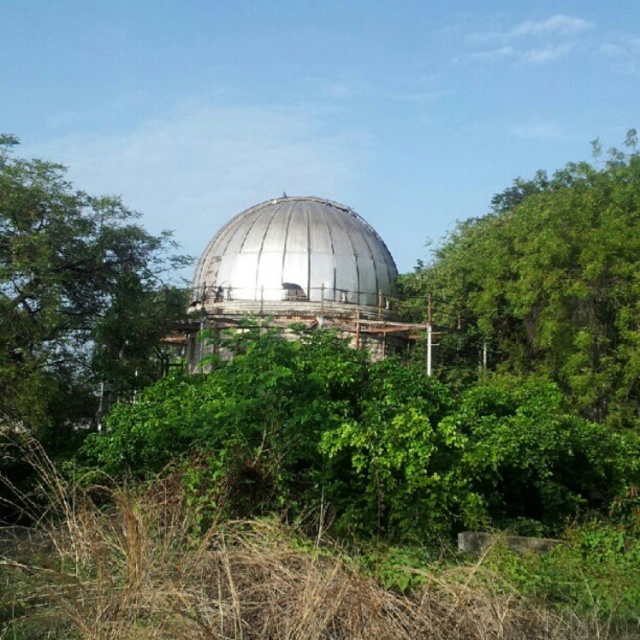
Is green leafy tree at upper right below metallic dome at center?

No, green leafy tree at upper right is not below metallic dome at center.

At what (x,y) coordinates should I click in order to perform the action: click on green leafy tree at upper right. Please return your answer as a coordinate pair (x, y). Looking at the image, I should click on (547, 284).

Does point (593, 416) come behind point (312, 237)?

No.

Locate an element on the screen. The image size is (640, 640). green leafy tree at upper right is located at coordinates (547, 284).

This screenshot has height=640, width=640. What do you see at coordinates (547, 284) in the screenshot? I see `green leafy tree at upper right` at bounding box center [547, 284].

Is the position of green leafy tree at upper right more distant than that of green leafy tree at left?

Yes, it is.

Locate an element on the screen. This screenshot has height=640, width=640. green leafy tree at upper right is located at coordinates (547, 284).

Where is `green leafy tree at upper right`? green leafy tree at upper right is located at coordinates (547, 284).

Can you confirm if green leafy tree at left is positioned to the left of metallic dome at center?

Correct, you'll find green leafy tree at left to the left of metallic dome at center.

Describe the element at coordinates (72, 307) in the screenshot. I see `green leafy tree at left` at that location.

Locate an element on the screen. This screenshot has height=640, width=640. green leafy tree at left is located at coordinates (72, 307).